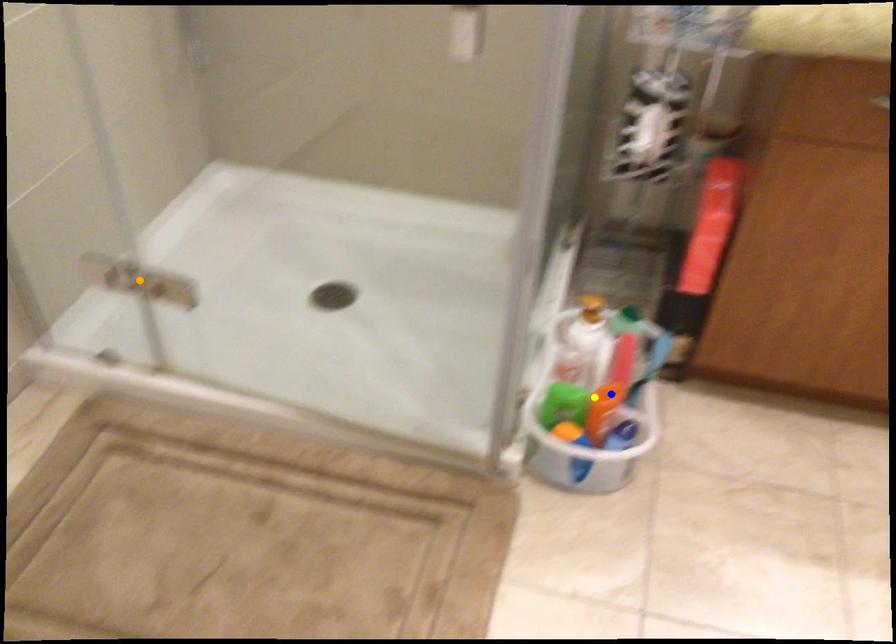
Order these from nearest to farthest:
1. yellow point
2. blue point
3. orange point

yellow point
orange point
blue point